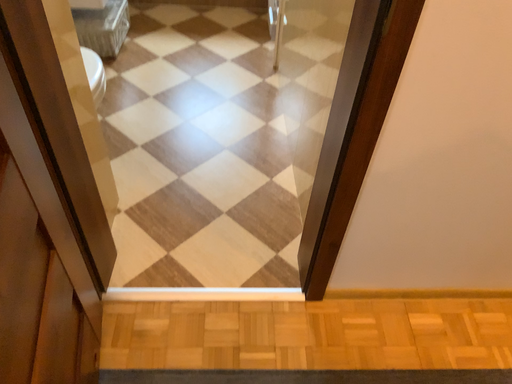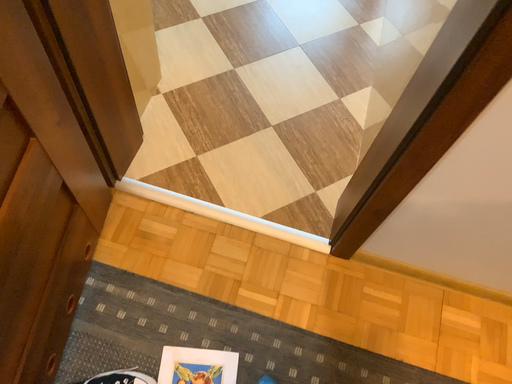
Question: How did the camera likely rotate when shooting the video?

Choices:
 (A) rotated upward
 (B) rotated downward

Answer: (B)